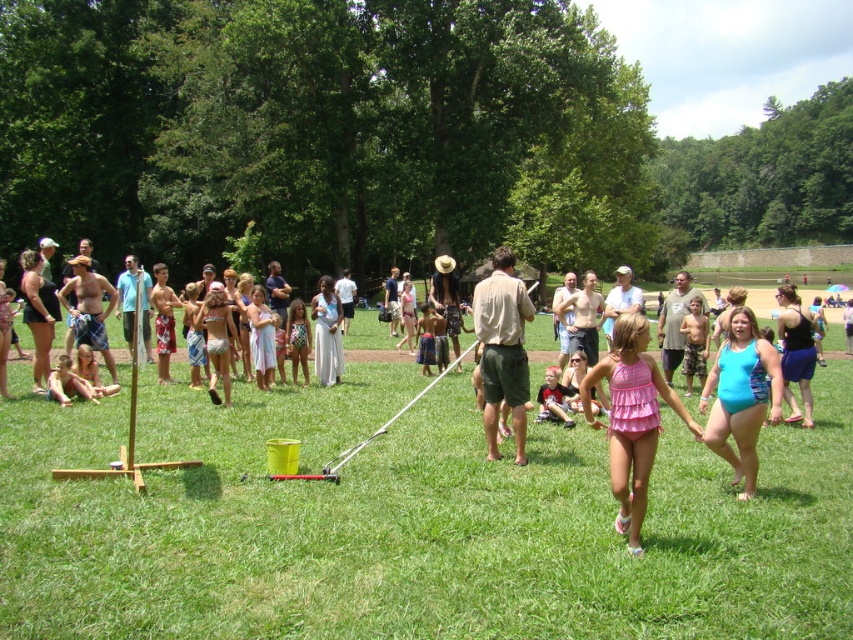
You are a photographer positioned at the origin point of the image coordinate system. You want to capture a photo of the blue swimsuit at center. What are the coordinates where you should aim your camera?

The coordinates where you should aim your camera are at point (x=741, y=396).

You are organizing a group photo for the event and need to position the pink fabric swimsuit at center and the blue swimsuit at center correctly. According to the scene, which swimwear is on the left side when looking at them from the front?

The pink fabric swimsuit at center is to the left of the blue swimsuit at center, so when looking from the front, the pink fabric swimsuit at center is on the left side.